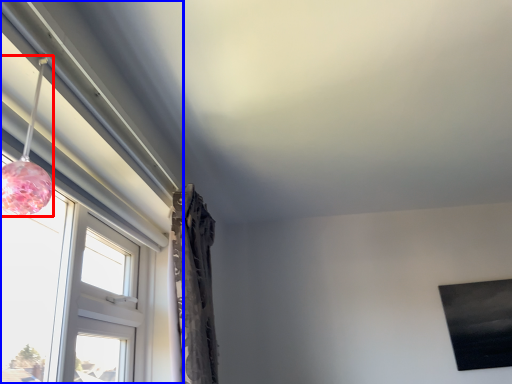
Question: Which point is further to the camera, lamp (highlighted by a red box) or window (highlighted by a blue box)?

Choices:
 (A) lamp
 (B) window

Answer: (B)